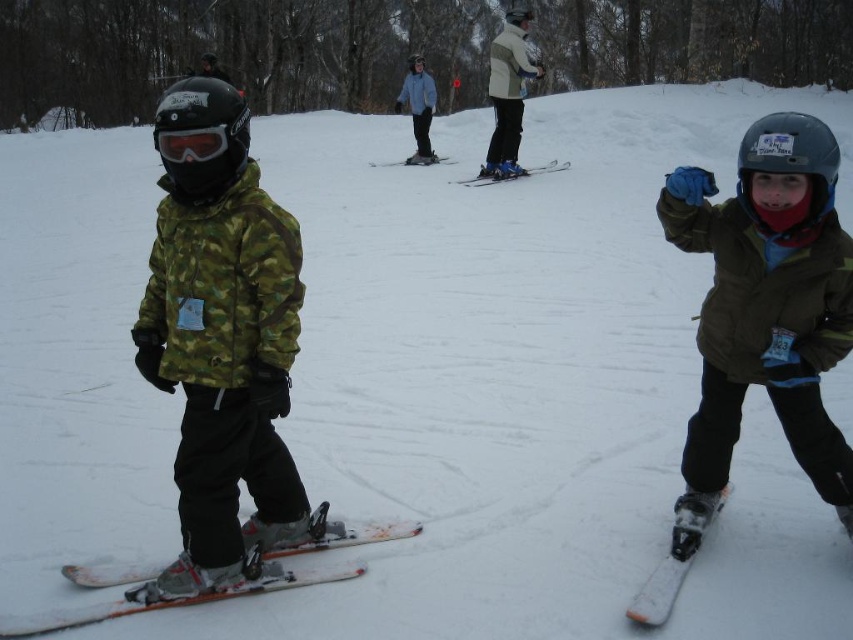
You are a photographer trying to capture a photo of both the matte green jacket at right and the matte black goggles at left in the same frame. Given their sizes, which object should you focus on first to ensure both are in the frame?

The matte green jacket at right has a greater height compared to the matte black goggles at left, so you should focus on the matte green jacket at right first to ensure both are in the frame.

You are standing at the point marked as point (821,496) in the snowy scene. A friendly snowman is 2 meters tall and needs to be placed somewhere in the scene. Can you determine if the snowman will be visible from your current position?

The snowman will be visible from your current position at point (821,496) because the distance between you and the snowman is 3.24 meters, which is greater than the snowman height of 2 meters. Since the snowman is taller than half the distance, it will be visible.